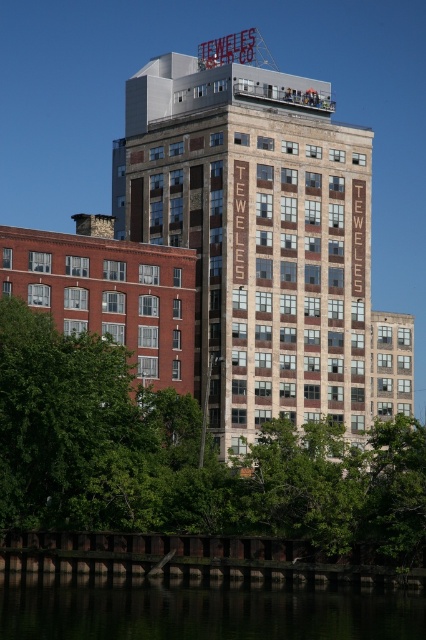
Question: From the image, what is the correct spatial relationship of brown brick building at center in relation to green reflective water at lower center?

Choices:
 (A) above
 (B) below

Answer: (A)

Question: Which point is closer to the camera taking this photo?

Choices:
 (A) (137, 611)
 (B) (210, 312)

Answer: (A)

Question: Which point is farther to the camera?

Choices:
 (A) green reflective water at lower center
 (B) brown brick building at center
 (C) green leafy tree at lower left

Answer: (B)

Question: Is green leafy tree at lower left positioned in front of green reflective water at lower center?

Choices:
 (A) yes
 (B) no

Answer: (B)

Question: Which point is farther to the camera?

Choices:
 (A) (331, 220)
 (B) (106, 508)

Answer: (A)

Question: Is brown brick building at center to the right of green reflective water at lower center from the viewer's perspective?

Choices:
 (A) yes
 (B) no

Answer: (B)